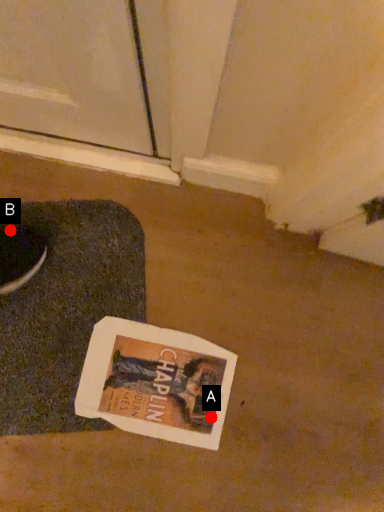
Question: Two points are circled on the image, labeled by A and B beside each circle. Which point is closer to the camera?

Choices:
 (A) A is closer
 (B) B is closer

Answer: (B)